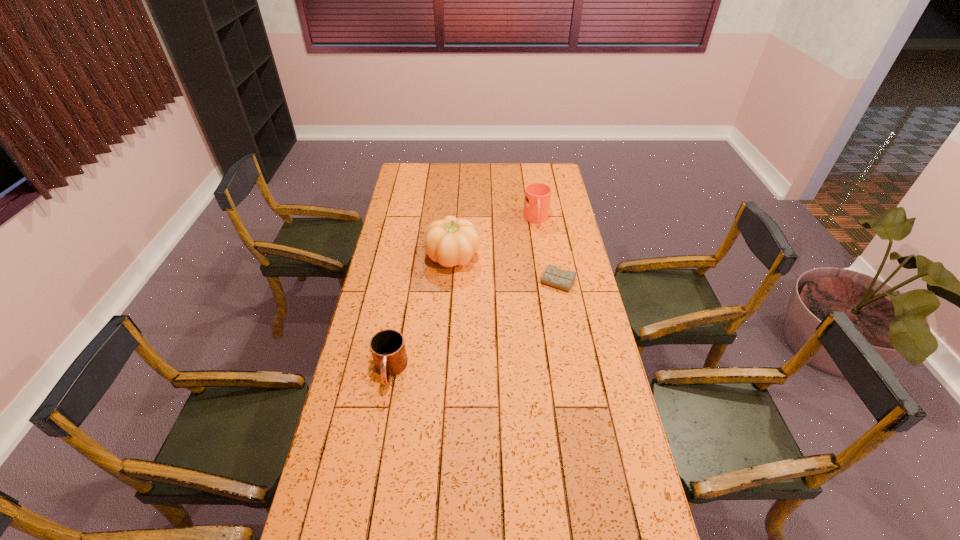
This screenshot has height=540, width=960. What are the coordinates of `the closest object to the shortest object` in the screenshot? It's located at (450, 241).

At what (x,y) coordinates should I click in order to perform the action: click on free space that satisfies the following two spatial constraints: 1. on the handle side of the diary; 2. on the right side of the farthest object. Please return your answer as a coordinate pair (x, y). Looking at the image, I should click on (546, 282).

The height and width of the screenshot is (540, 960). Find the location of `free space that satisfies the following two spatial constraints: 1. on the front side of the shortest object; 2. on the left side of the pumpkin`. free space that satisfies the following two spatial constraints: 1. on the front side of the shortest object; 2. on the left side of the pumpkin is located at coordinates (451, 282).